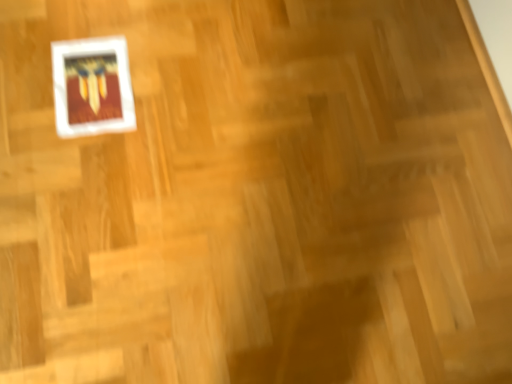
Locate an element on the screen. The height and width of the screenshot is (384, 512). free space in front of white glossy picture frame at upper left is located at coordinates (65, 158).